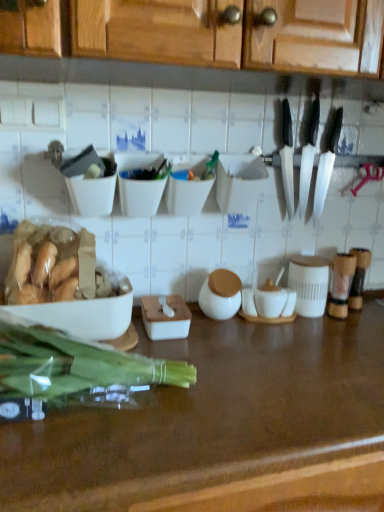
Where is `vacant space in front of translucent plastic green vegetables at left`? The width and height of the screenshot is (384, 512). vacant space in front of translucent plastic green vegetables at left is located at coordinates (91, 452).